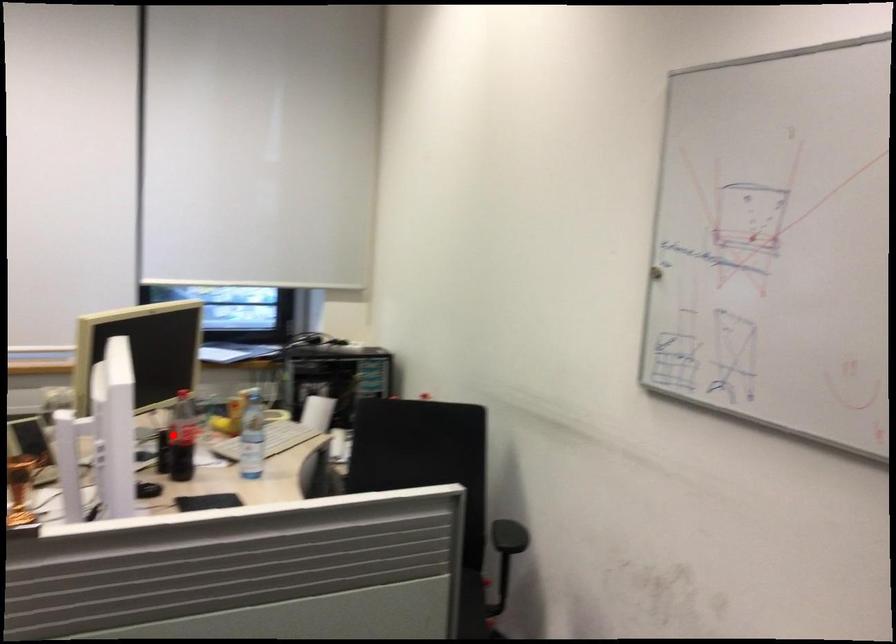
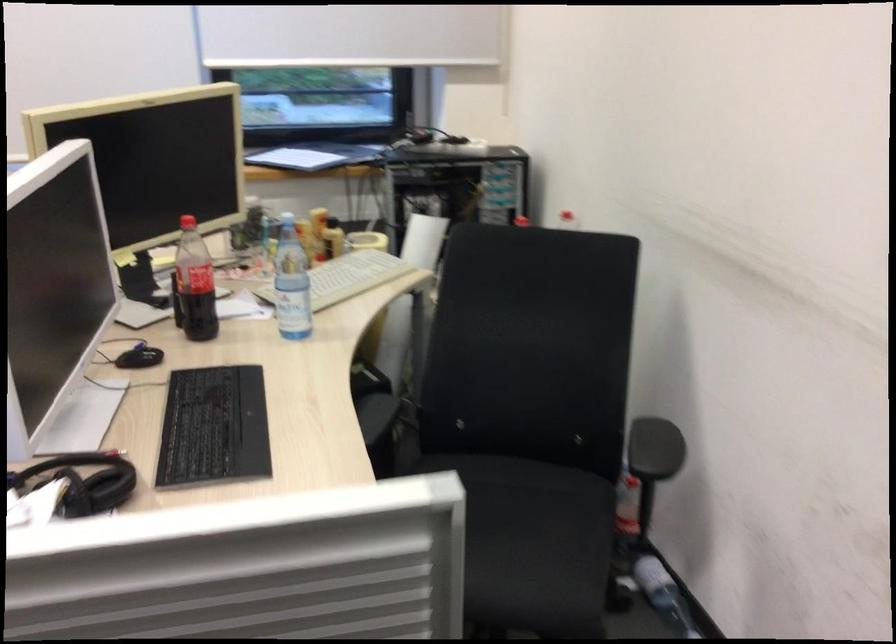
Question: I am providing you with two images of the same scene from different viewpoints. Given a red point in image1, look at the same physical point in image2. Is it:

Choices:
 (A) Closer to the viewpoint
 (B) Farther from the viewpoint

Answer: (A)